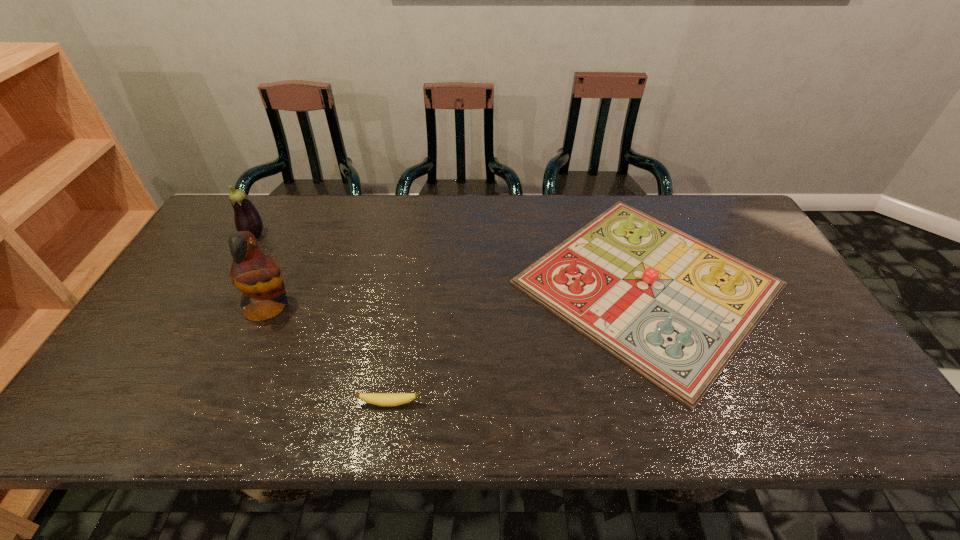
Locate an element on the screen. Image resolution: width=960 pixels, height=540 pixels. free spot located on the left of the rightmost object is located at coordinates (439, 284).

In order to click on free space located 0.210m on the back of the second object from right to left in this screenshot , I will do `click(402, 325)`.

The height and width of the screenshot is (540, 960). In order to click on eggplant situated at the far edge in this screenshot , I will do `click(246, 216)`.

The image size is (960, 540). In order to click on gameboard that is positioned at the far edge in this screenshot , I will do `click(675, 309)`.

Where is `gameboard located in the near edge section of the desktop`? The height and width of the screenshot is (540, 960). gameboard located in the near edge section of the desktop is located at coordinates (675, 309).

Find the location of `banana that is at the near edge`. banana that is at the near edge is located at coordinates tap(381, 399).

Where is `object that is at the left edge`? The width and height of the screenshot is (960, 540). object that is at the left edge is located at coordinates (246, 216).

The height and width of the screenshot is (540, 960). I want to click on object that is at the right edge, so [675, 309].

This screenshot has width=960, height=540. Identify the location of object positioned at the far left corner. (246, 216).

The image size is (960, 540). I want to click on object located in the far right corner section of the desktop, so (675, 309).